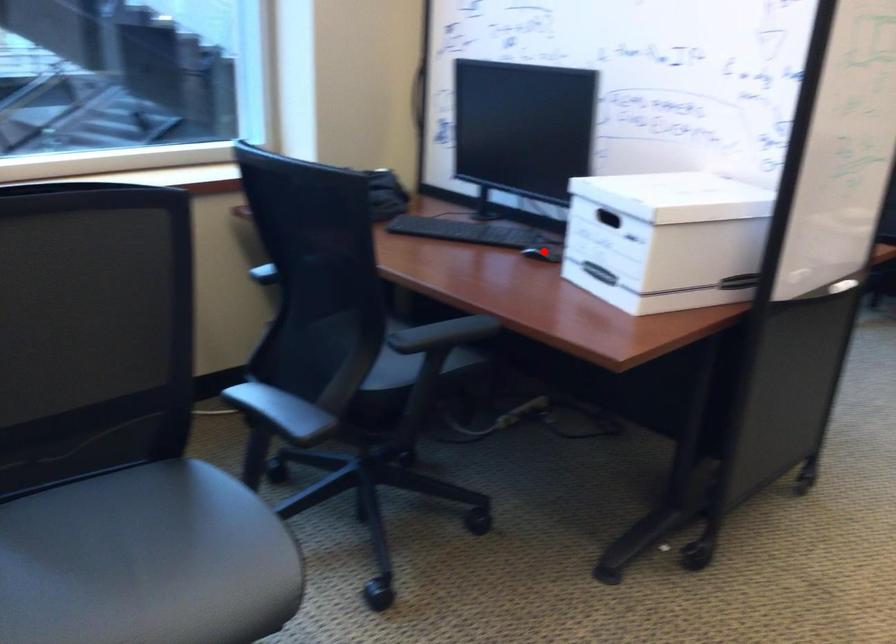
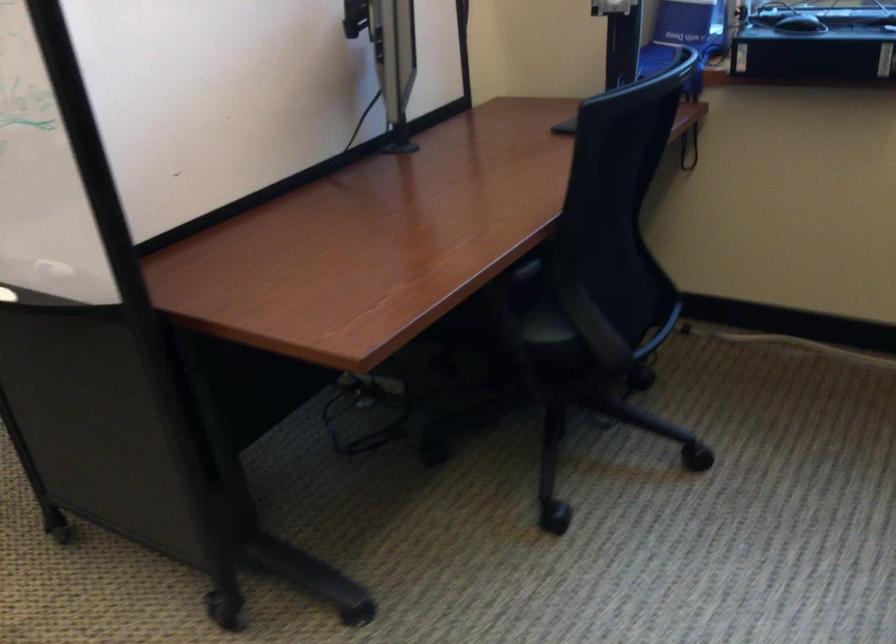
Question: I am providing you with two images of the same scene from different viewpoints. A red point is marked on the first image. At the location where the point appears in image 1, is it still visible in image 2?

Choices:
 (A) Yes
 (B) No

Answer: (B)